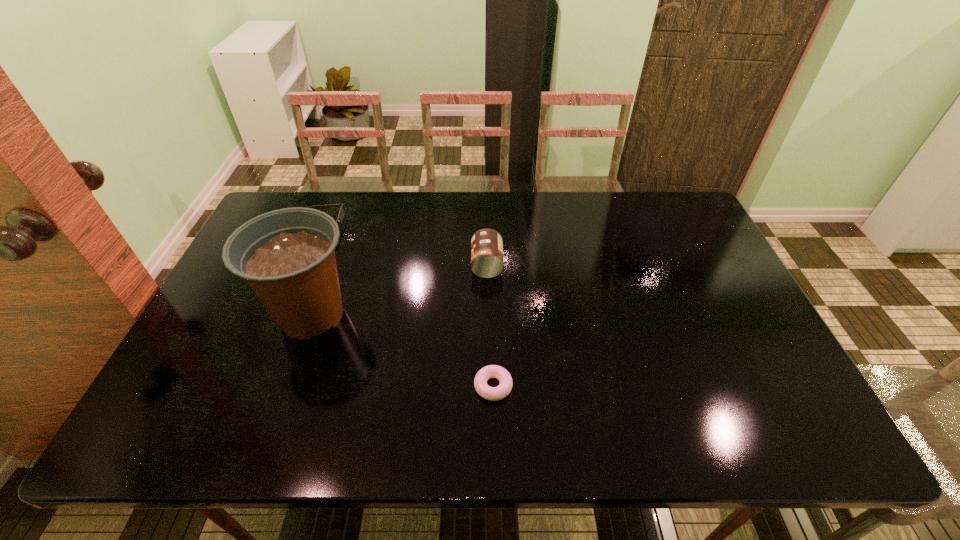
You are a GUI agent. You are given a task and a screenshot of the screen. Output one action in this format:
    pyautogui.click(x=<x>, y=<y>)
    Task: Click on the free space at the right edge
    The height and width of the screenshot is (540, 960).
    Given the screenshot: What is the action you would take?
    pyautogui.click(x=711, y=286)

The height and width of the screenshot is (540, 960). In order to click on blank area at the far right corner in this screenshot , I will do `click(651, 198)`.

Identify the location of free space between the farthest object and the nearest object. The width and height of the screenshot is (960, 540). (406, 307).

Identify the location of vacant region between the tallest object and the doughnut. The width and height of the screenshot is (960, 540). (402, 350).

At what (x,y) coordinates should I click in order to perform the action: click on free point between the third nearest object and the farthest object. Please return your answer as a coordinate pair (x, y). The height and width of the screenshot is (540, 960). Looking at the image, I should click on (402, 246).

Locate an element on the screen. The image size is (960, 540). free space that is in between the second nearest object and the nearest object is located at coordinates (402, 350).

You are a GUI agent. You are given a task and a screenshot of the screen. Output one action in this format:
    pyautogui.click(x=<x>, y=<y>)
    Task: Click on the vacant space in between the second farthest object and the shortest object
    This screenshot has height=540, width=960.
    Given the screenshot: What is the action you would take?
    pyautogui.click(x=490, y=325)

I want to click on vacant region between the shortest object and the second farthest object, so click(490, 325).

Identify the location of empty location between the flowerpot and the can. (399, 289).

Choose which object is the second nearest neighbor to the third farthest object. Please provide its 2D coordinates. Your answer should be formatted as a tuple, i.e. [(x, y)], where the tuple contains the x and y coordinates of a point satisfying the conditions above.

[(487, 261)]